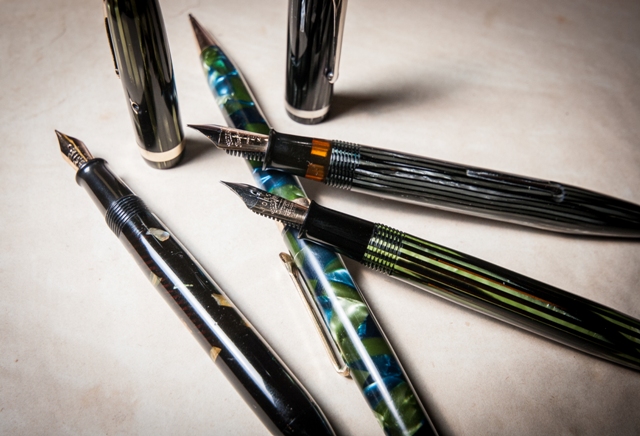
The image size is (640, 436). I want to click on pens, so click(x=147, y=263), click(x=329, y=288), click(x=345, y=238), click(x=372, y=165).